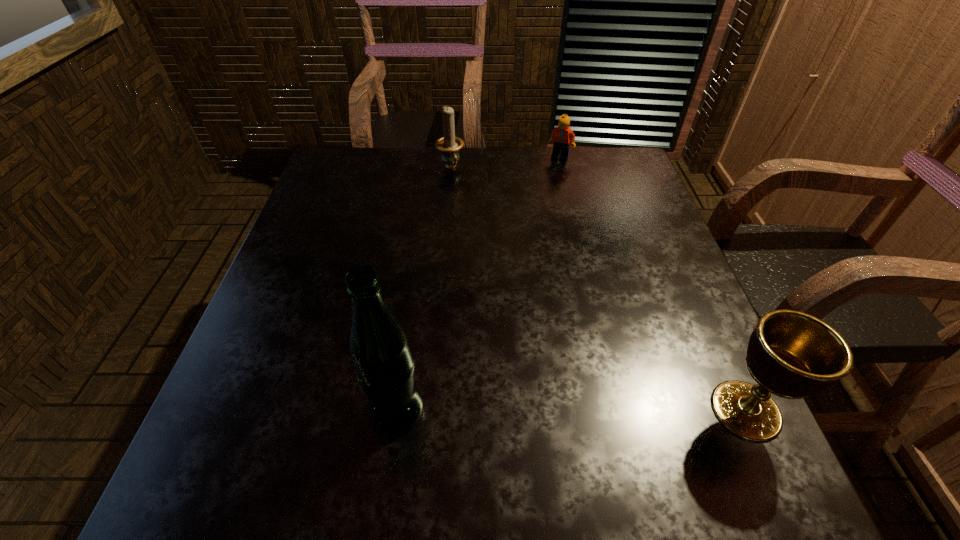
You are a GUI agent. You are given a task and a screenshot of the screen. Output one action in this format:
    pyautogui.click(x=<x>, y=<y>)
    Task: Click on the vacant space on the desktop that is between the beer bottle and the chalice and is positioned on the front-facing side of the third object from left to right
    
    Given the screenshot: What is the action you would take?
    pyautogui.click(x=590, y=410)

You are a GUI agent. You are given a task and a screenshot of the screen. Output one action in this format:
    pyautogui.click(x=<x>, y=<y>)
    Task: Click on the vacant space on the desktop that is between the tallest object and the chalice and is positioned on the handle side of the candle_holder
    This screenshot has height=540, width=960.
    Given the screenshot: What is the action you would take?
    pyautogui.click(x=588, y=410)